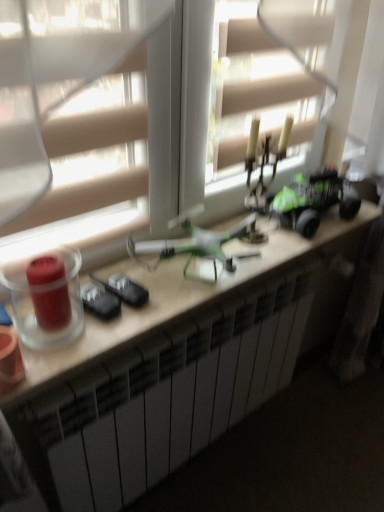
In order to face green matte toy car at right, should I rotate leftwards or rightwards?

Rotate your view right by about 16.133°.

The width and height of the screenshot is (384, 512). Describe the element at coordinates (314, 201) in the screenshot. I see `green matte toy car at right` at that location.

What do you see at coordinates (185, 126) in the screenshot? I see `transparent plastic window at center` at bounding box center [185, 126].

Find the location of a particular element. white matte desk at center is located at coordinates [175, 367].

Between white matte desk at center and transparent glass candle at left, the second candle holder positioned from the right, which one is positioned in front?

transparent glass candle at left, the second candle holder positioned from the right, is more forward.

Is white matte desk at center positioned far away from transparent glass candle at left, arranged as the 1th candle holder when viewed from the left?

They are positioned close to each other.

Does white matte desk at center contain transparent glass candle at left, arranged as the 1th candle holder when viewed from the left?

No, white matte desk at center does not contain transparent glass candle at left, arranged as the 1th candle holder when viewed from the left.

From a real-world perspective, count 2nd candle holders upward from the white matte desk at center and point to it. Please provide its 2D coordinates.

[(46, 297)]

Consider the image. Is matte red candle holder at left, which ranks as the second candle holder in left-to-right order, in contact with white matte desk at center?

No, matte red candle holder at left, which ranks as the second candle holder in left-to-right order, is not next to white matte desk at center.

Find the location of `candle holder that is the 1st object above the white matte desk at center (from a real-world perspective)`. candle holder that is the 1st object above the white matte desk at center (from a real-world perspective) is located at coordinates (49, 292).

How distant is matte red candle holder at left, the first candle holder from the right, from white matte desk at center?

The distance of matte red candle holder at left, the first candle holder from the right, from white matte desk at center is 17.78 inches.

Can you confirm if matte red candle holder at left, which ranks as the second candle holder in left-to-right order, is positioned to the right of white matte desk at center?

Incorrect, matte red candle holder at left, which ranks as the second candle holder in left-to-right order, is not on the right side of white matte desk at center.

Would you say transparent glass candle at left, the second candle holder positioned from the right, contains matte red candle holder at left, the first candle holder from the right?

Indeed, matte red candle holder at left, the first candle holder from the right, is located within transparent glass candle at left, the second candle holder positioned from the right.

Can you tell me how much transparent glass candle at left, arranged as the 1th candle holder when viewed from the left, and matte red candle holder at left, the first candle holder from the right, differ in facing direction?

They differ by 0.129 degrees in their facing directions.

Which object is positioned more to the right, transparent glass candle at left, arranged as the 1th candle holder when viewed from the left, or matte red candle holder at left, which ranks as the second candle holder in left-to-right order?

Positioned to the right is matte red candle holder at left, which ranks as the second candle holder in left-to-right order.

Is transparent glass candle at left, arranged as the 1th candle holder when viewed from the left, facing towards matte red candle holder at left, which ranks as the second candle holder in left-to-right order?

Yes, transparent glass candle at left, arranged as the 1th candle holder when viewed from the left, is facing matte red candle holder at left, which ranks as the second candle holder in left-to-right order.

Based on the photo, does green matte toy car at right have a larger size compared to transparent plastic window at center?

Actually, green matte toy car at right might be smaller than transparent plastic window at center.

Is green matte toy car at right next to transparent plastic window at center?

green matte toy car at right is not next to transparent plastic window at center, and they're not touching.

From a real-world perspective, is green matte toy car at right positioned over transparent plastic window at center based on gravity?

Incorrect, from a real-world perspective, green matte toy car at right is lower than transparent plastic window at center.

Is green matte toy car at right oriented towards transparent plastic window at center?

No, green matte toy car at right does not turn towards transparent plastic window at center.

Which point is more distant from viewer, (x=280, y=222) or (x=17, y=302)?

The point (x=280, y=222) is more distant.

From the image's perspective, does green matte toy car at right appear lower than transparent glass candle at left, arranged as the 1th candle holder when viewed from the left?

Actually, green matte toy car at right appears above transparent glass candle at left, arranged as the 1th candle holder when viewed from the left, in the image.

In terms of height, does green matte toy car at right look taller or shorter compared to transparent glass candle at left, the second candle holder positioned from the right?

Clearly, green matte toy car at right is shorter compared to transparent glass candle at left, the second candle holder positioned from the right.

Which is in front, green matte toy car at right or transparent glass candle at left, arranged as the 1th candle holder when viewed from the left?

transparent glass candle at left, arranged as the 1th candle holder when viewed from the left, is more forward.

Based on the photo, considering the relative sizes of transparent glass candle at left, arranged as the 1th candle holder when viewed from the left, and transparent plastic window at center in the image provided, is transparent glass candle at left, arranged as the 1th candle holder when viewed from the left, thinner than transparent plastic window at center?

Yes, transparent glass candle at left, arranged as the 1th candle holder when viewed from the left, is thinner than transparent plastic window at center.

Looking at the image, does transparent glass candle at left, the second candle holder positioned from the right, seem bigger or smaller compared to transparent plastic window at center?

In the image, transparent glass candle at left, the second candle holder positioned from the right, appears to be smaller than transparent plastic window at center.

Between transparent glass candle at left, arranged as the 1th candle holder when viewed from the left, and transparent plastic window at center, which one is positioned in front?

transparent plastic window at center.

Considering the sizes of objects white matte desk at center and matte red candle holder at left, which ranks as the second candle holder in left-to-right order, in the image provided, who is smaller, white matte desk at center or matte red candle holder at left, which ranks as the second candle holder in left-to-right order,?

Smaller between the two is matte red candle holder at left, which ranks as the second candle holder in left-to-right order.

Is white matte desk at center positioned far away from matte red candle holder at left, which ranks as the second candle holder in left-to-right order?

No.

Considering the sizes of white matte desk at center and matte red candle holder at left, the first candle holder from the right, in the image, is white matte desk at center taller or shorter than matte red candle holder at left, the first candle holder from the right,?

white matte desk at center is taller than matte red candle holder at left, the first candle holder from the right.

Which of these two, white matte desk at center or matte red candle holder at left, the first candle holder from the right, is wider?

With larger width is white matte desk at center.

Identify the location of desk lying behind the transparent glass candle at left, arranged as the 1th candle holder when viewed from the left. point(175,367).

This screenshot has height=512, width=384. I want to click on the 1st candle holder in front when counting from the white matte desk at center, so click(x=49, y=292).

Based on their spatial positions, is green matte toy car at right or transparent plastic window at center closer to white matte desk at center?

transparent plastic window at center.

Looking at this image, when comparing their distances from transparent glass candle at left, the second candle holder positioned from the right, does matte red candle holder at left, the first candle holder from the right, or green matte toy car at right seem further?

Among the two, green matte toy car at right is located further to transparent glass candle at left, the second candle holder positioned from the right.

Considering their positions, is white matte desk at center positioned further to transparent glass candle at left, the second candle holder positioned from the right, than matte red candle holder at left, the first candle holder from the right?

Among the two, white matte desk at center is located further to transparent glass candle at left, the second candle holder positioned from the right.

Looking at the image, which one is located closer to transparent plastic window at center, white matte desk at center or green matte toy car at right?

The object closer to transparent plastic window at center is green matte toy car at right.

When comparing their distances from green matte toy car at right, does matte red candle holder at left, which ranks as the second candle holder in left-to-right order, or transparent glass candle at left, arranged as the 1th candle holder when viewed from the left, seem further?

matte red candle holder at left, which ranks as the second candle holder in left-to-right order, is further to green matte toy car at right.

Looking at the image, which one is located closer to green matte toy car at right, transparent glass candle at left, the second candle holder positioned from the right, or white matte desk at center?

white matte desk at center.

Estimate the real-world distances between objects in this image. Which object is closer to transparent plastic window at center, transparent glass candle at left, the second candle holder positioned from the right, or matte red candle holder at left, the first candle holder from the right?

The object closer to transparent plastic window at center is transparent glass candle at left, the second candle holder positioned from the right.

Looking at the image, which one is located further to transparent glass candle at left, the second candle holder positioned from the right, transparent plastic window at center or matte red candle holder at left, the first candle holder from the right?

transparent plastic window at center lies further to transparent glass candle at left, the second candle holder positioned from the right, than the other object.

At what (x,y) coordinates should I click in order to perform the action: click on window situated between matte red candle holder at left, which ranks as the second candle holder in left-to-right order, and green matte toy car at right from left to right. Please return your answer as a coordinate pair (x, y). Image resolution: width=384 pixels, height=512 pixels. Looking at the image, I should click on (185, 126).

Locate an element on the screen. window between transparent glass candle at left, arranged as the 1th candle holder when viewed from the left, and green matte toy car at right is located at coordinates (185, 126).

Identify the location of model car that lies between transparent plastic window at center and white matte desk at center from top to bottom. (314, 201).

Identify the location of candle holder between transparent glass candle at left, the second candle holder positioned from the right, and white matte desk at center from left to right. This screenshot has width=384, height=512. (49, 292).